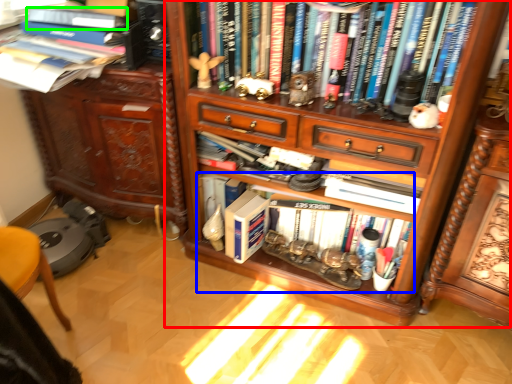
Question: Which object is positioned farthest from bookcase (highlighted by a red box)? Select from book (highlighted by a blue box) and book (highlighted by a green box).

Choices:
 (A) book
 (B) book

Answer: (B)